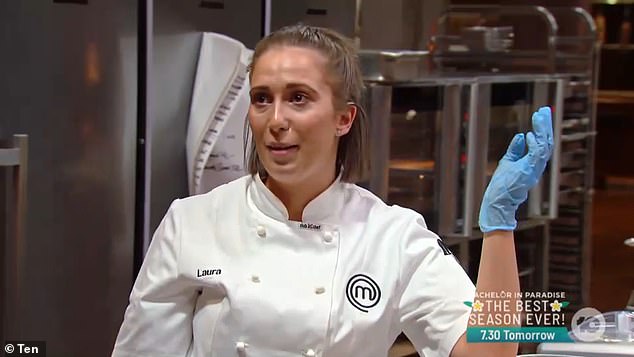
Locate an element on the screen. Image resolution: width=634 pixels, height=357 pixels. oven is located at coordinates (434, 139).